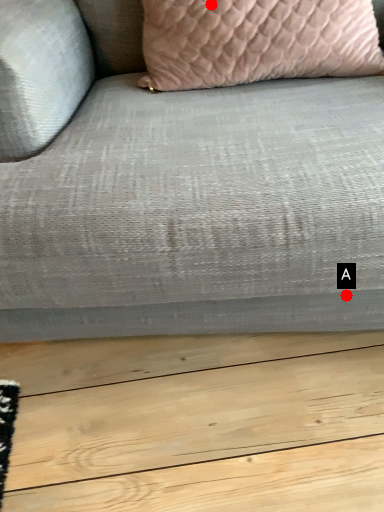
Question: Two points are circled on the image, labeled by A and B beside each circle. Which point is further to the camera?

Choices:
 (A) A is further
 (B) B is further

Answer: (B)